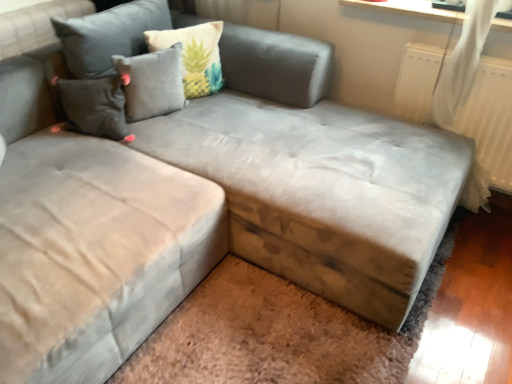
Question: Is brown wood storage at lower right to the left of beige fabric pillow at upper center, which is counted as the second pillow, starting from the left, from the viewer's perspective?

Choices:
 (A) yes
 (B) no

Answer: (B)

Question: Can you confirm if brown wood storage at lower right is wider than beige fabric pillow at upper center, which is counted as the second pillow, starting from the left?

Choices:
 (A) no
 (B) yes

Answer: (B)

Question: Is the position of brown wood storage at lower right more distant than that of beige fabric pillow at upper center, which is counted as the second pillow, starting from the left?

Choices:
 (A) no
 (B) yes

Answer: (A)

Question: Is brown wood storage at lower right far from beige fabric pillow at upper center, which is counted as the second pillow, starting from the left?

Choices:
 (A) no
 (B) yes

Answer: (B)

Question: From a real-world perspective, is brown wood storage at lower right on beige fabric pillow at upper center, acting as the 1th pillow starting from the right?

Choices:
 (A) no
 (B) yes

Answer: (A)

Question: From their relative heights in the image, would you say gray fabric pillow at upper center, which is the first pillow in left-to-right order, is taller or shorter than beige fabric pillow at upper center, acting as the 1th pillow starting from the right?

Choices:
 (A) short
 (B) tall

Answer: (A)

Question: From a real-world perspective, is gray fabric pillow at upper center, which is the 2th pillow from right to left, positioned above or below beige fabric pillow at upper center, acting as the 1th pillow starting from the right?

Choices:
 (A) below
 (B) above

Answer: (A)

Question: Is gray fabric pillow at upper center, which is the first pillow in left-to-right order, in front of or behind beige fabric pillow at upper center, which is counted as the second pillow, starting from the left, in the image?

Choices:
 (A) behind
 (B) front

Answer: (B)

Question: Choose the correct answer: Is gray fabric pillow at upper center, which is the first pillow in left-to-right order, inside beige fabric pillow at upper center, acting as the 1th pillow starting from the right, or outside it?

Choices:
 (A) outside
 (B) inside

Answer: (A)

Question: Does point (157, 72) appear closer or farther from the camera than point (313, 296)?

Choices:
 (A) closer
 (B) farther

Answer: (B)

Question: Looking at their shapes, would you say gray fabric pillow at upper center, which is the 2th pillow from right to left, is wider or thinner than brown wood storage at lower right?

Choices:
 (A) thin
 (B) wide

Answer: (A)

Question: From a real-world perspective, is gray fabric pillow at upper center, which is the 2th pillow from right to left, above or below brown wood storage at lower right?

Choices:
 (A) below
 (B) above

Answer: (B)

Question: In the image, is gray fabric pillow at upper center, which is the first pillow in left-to-right order, positioned in front of or behind brown wood storage at lower right?

Choices:
 (A) front
 (B) behind

Answer: (B)

Question: Relative to gray fabric pillow at upper center, which is the first pillow in left-to-right order, is brown wood storage at lower right in front or behind?

Choices:
 (A) front
 (B) behind

Answer: (A)

Question: From a real-world perspective, relative to gray fabric pillow at upper center, which is the first pillow in left-to-right order, is brown wood storage at lower right vertically above or below?

Choices:
 (A) below
 (B) above

Answer: (A)